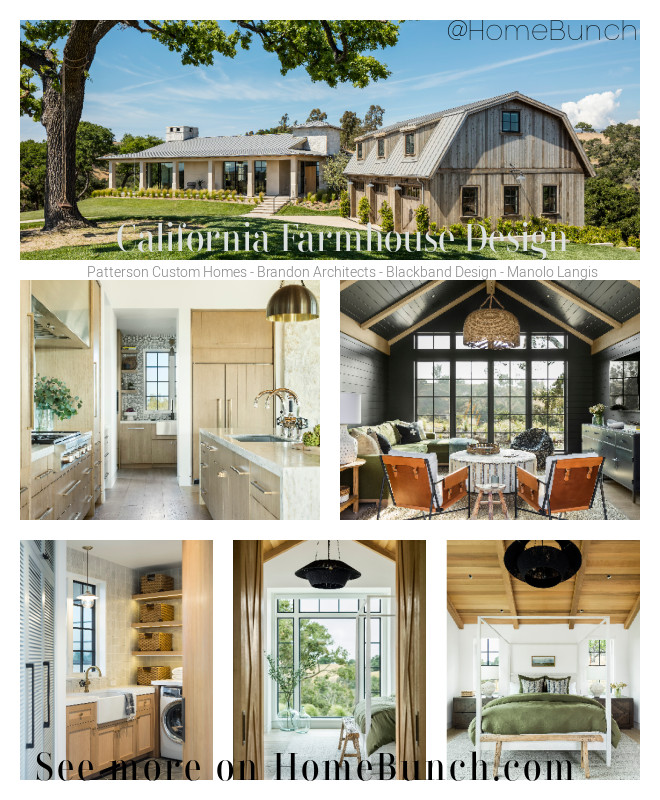
The width and height of the screenshot is (660, 800). In order to click on windows in this screenshot , I will do `click(323, 654)`, `click(86, 634)`, `click(76, 650)`, `click(463, 385)`, `click(507, 384)`, `click(550, 382)`, `click(426, 378)`, `click(543, 338)`, `click(426, 342)`, `click(156, 380)`.